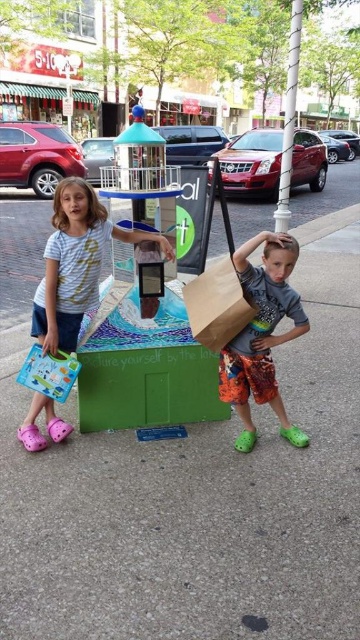
Between matte white shirt at left and matte gray shirt at center, which one has more height?

With more height is matte gray shirt at center.

Between point (52, 260) and point (276, 285), which one is positioned in front?

Point (276, 285)

Does point (65, 244) come in front of point (293, 268)?

No.

The width and height of the screenshot is (360, 640). Find the location of `matte white shirt at left`. matte white shirt at left is located at coordinates (75, 262).

Which is in front, point (65, 333) or point (225, 324)?

Point (225, 324) is in front.

Does matte white shirt at left have a lesser height compared to brown paper bag at center?

Incorrect, matte white shirt at left's height does not fall short of brown paper bag at center's.

The image size is (360, 640). Find the location of `matte white shirt at left`. matte white shirt at left is located at coordinates (75, 262).

Is matte gray shirt at center in front of brown paper bag at center?

Yes, matte gray shirt at center is closer to the viewer.

Image resolution: width=360 pixels, height=640 pixels. Describe the element at coordinates (262, 336) in the screenshot. I see `matte gray shirt at center` at that location.

You are a GUI agent. You are given a task and a screenshot of the screen. Output one action in this format:
    pyautogui.click(x=<x>, y=<y>)
    Task: Click on the matte gray shirt at center
    
    Given the screenshot: What is the action you would take?
    pyautogui.click(x=262, y=336)